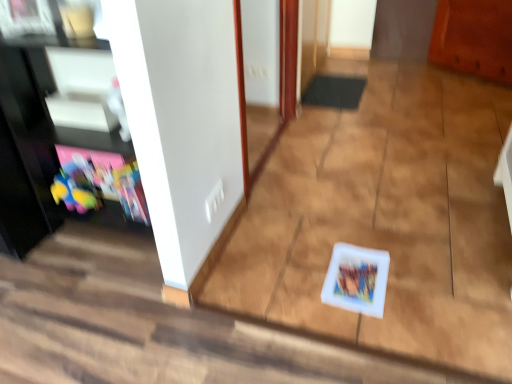
Locate an element on the screen. free point to the left of white matte card game at center is located at coordinates (300, 280).